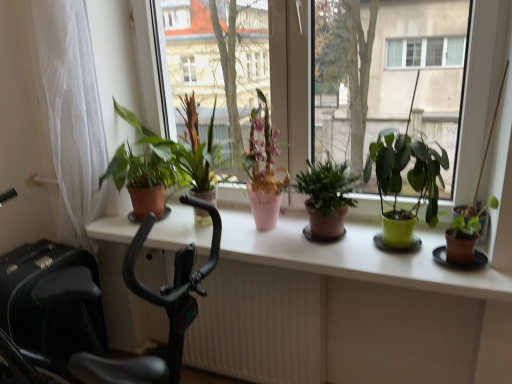
This screenshot has width=512, height=384. What are the coordinates of `free space below green matte plant at center, the 3th houseplant viewed from the left (from a real-world perspective)` in the screenshot? It's located at (327, 246).